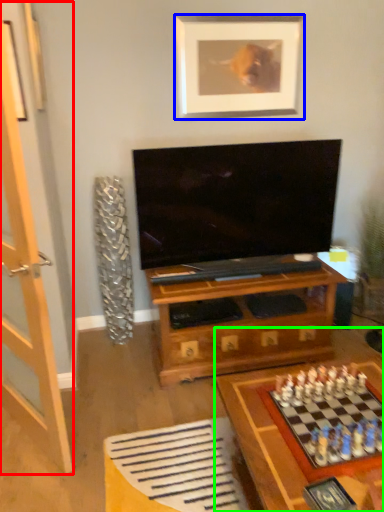
Question: Considering the real-world distances, which object is closest to glass door (highlighted by a red box)? picture frame (highlighted by a blue box) or table (highlighted by a green box).

Choices:
 (A) picture frame
 (B) table

Answer: (B)